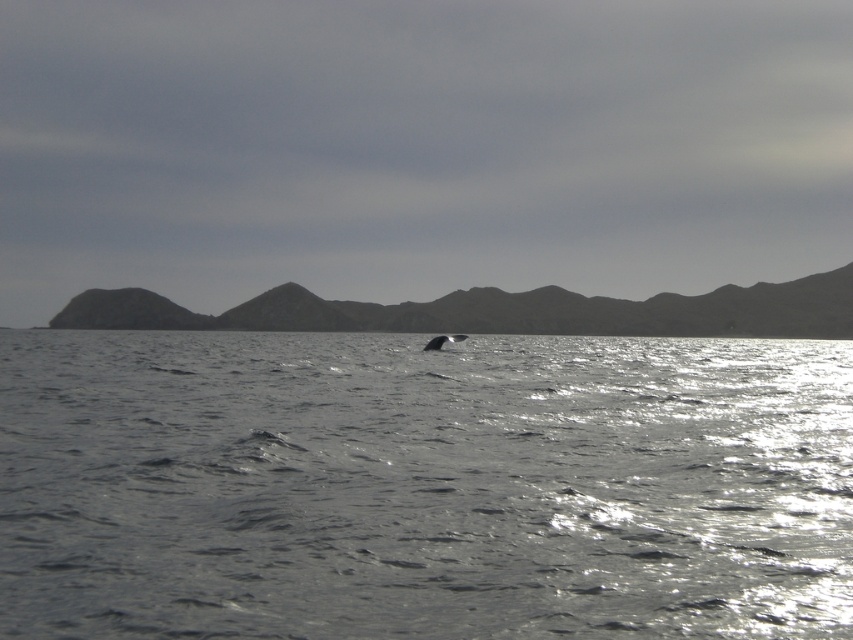
You are a photographer standing at the center of the seascape. You want to capture both the dark whale fin at point (91, 452) and the distant hills at point (457, 333) in the same frame. Which point should you focus on first to ensure both are in focus?

You should focus on point (457, 333) first because it is farther away than point (91, 452). By focusing on the distant hills, the whale fin closer to the camera will also be within the depth of field, ensuring both are in focus.

You are a marine biologist observing the seascape. You notice a point marked at coordinates (x=422, y=486). What does this point represent?

The point at (x=422, y=486) represents the glistening silver water at center.

You are a marine biologist observing the seascape. You notice the glistening silver water at center and the gray matte whale at center. Which object takes up more space in the image?

The glistening silver water at center is bigger than the gray matte whale at center, so it takes up more space in the image.